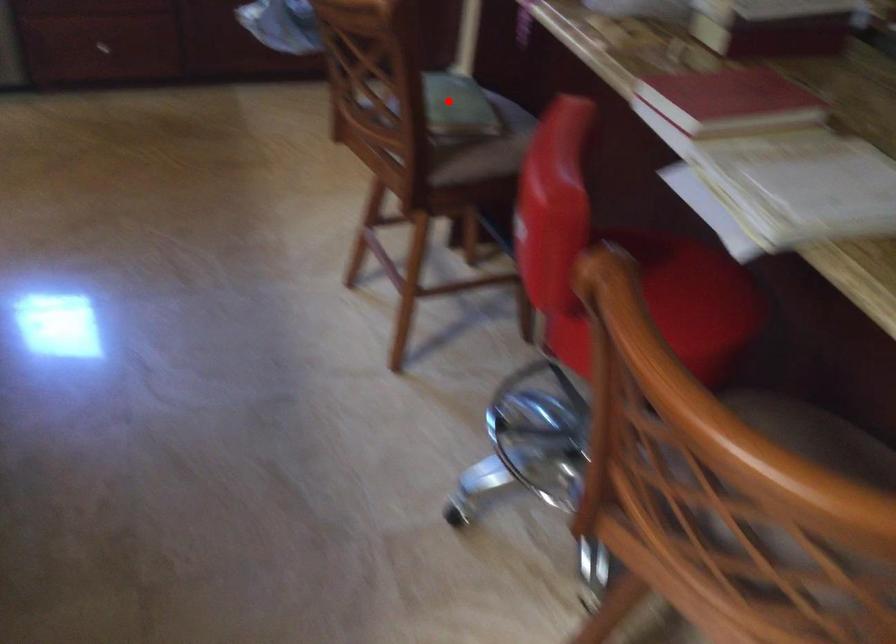
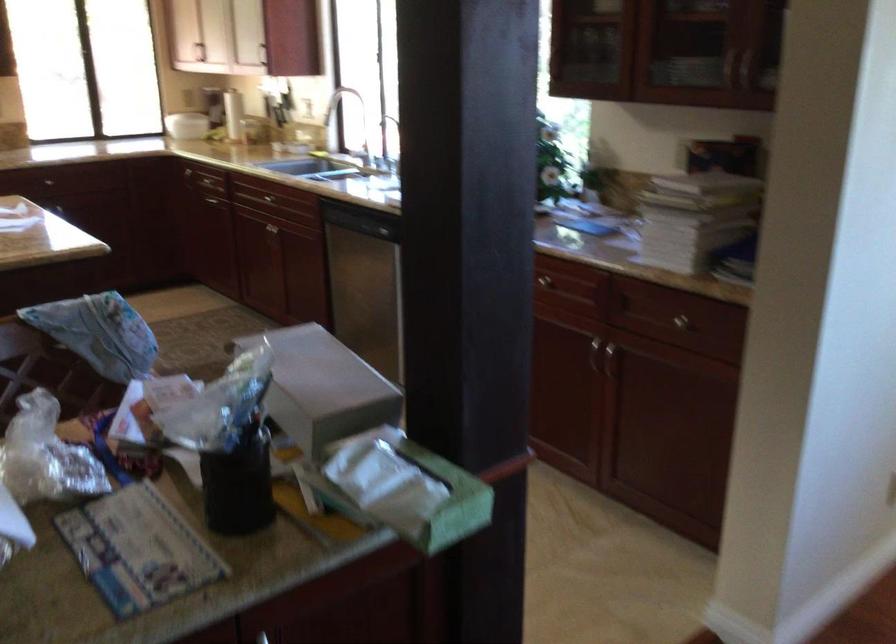
Question: I am providing you with two images of the same scene from different viewpoints. A red point is marked on the first image. At the location where the point appears in image 1, is it still visible in image 2?

Choices:
 (A) Yes
 (B) No

Answer: (B)